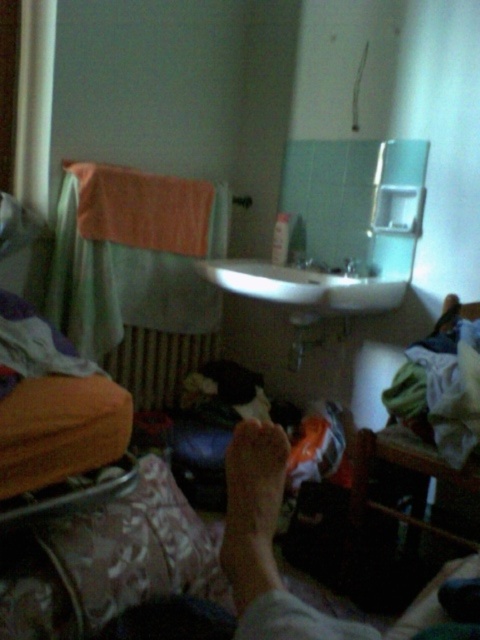
You are trying to reach the white glossy faucet at upper center but need to avoid touching the orange towel at left. Based on their positions, which direction should you move to the right to avoid it?

The orange towel at left is on the left side of the white glossy faucet at upper center, so moving to the right of the faucet would keep you away from the towel.